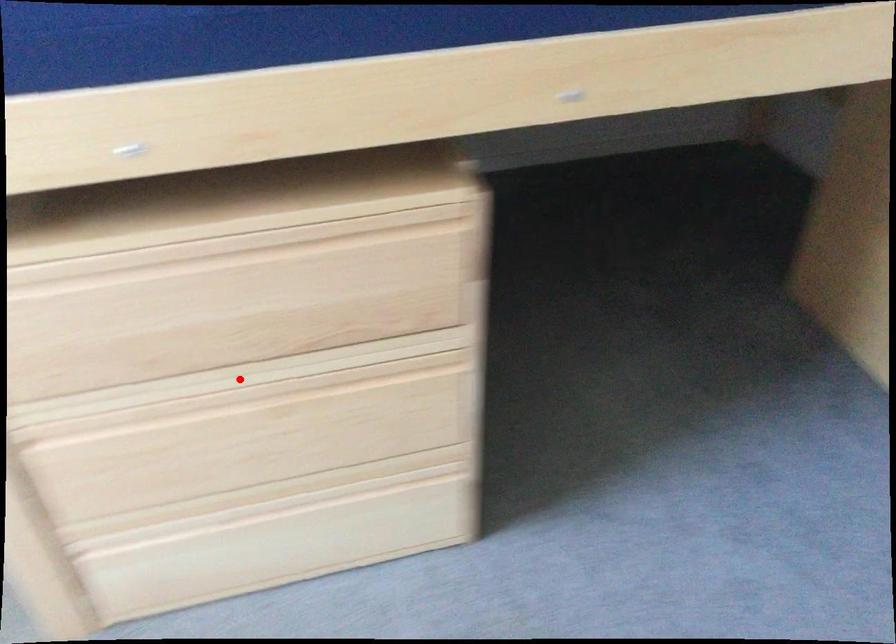
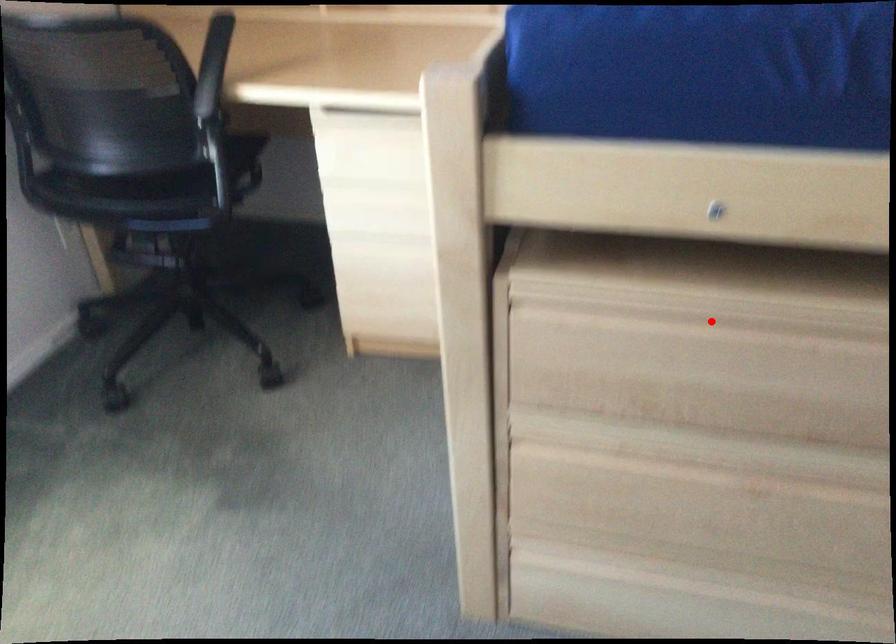
I am providing you with two images of the same scene from different viewpoints. A red point is marked on the first image and another point is marked on the second image. Are the points marked in image1 and image2 representing the same 3D position?

No